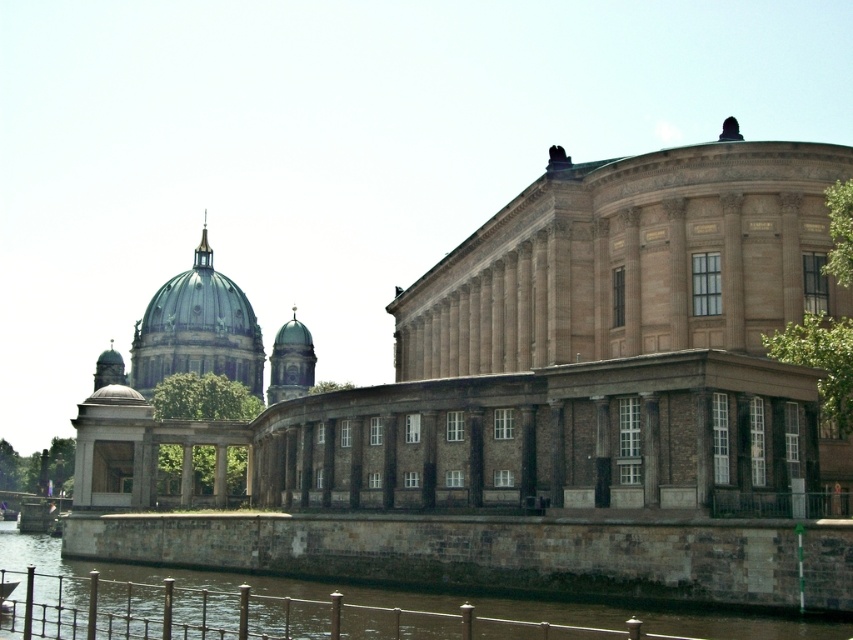
Question: Is brown stone building at center to the right of brown stone wall at lower left from the viewer's perspective?

Choices:
 (A) no
 (B) yes

Answer: (A)

Question: Which of the following is the closest to the observer?

Choices:
 (A) brown stone wall at lower left
 (B) brown stone building at center

Answer: (A)

Question: Is brown stone building at center smaller than brown stone wall at lower left?

Choices:
 (A) no
 (B) yes

Answer: (A)

Question: Can you confirm if brown stone building at center is positioned to the left of brown stone wall at lower left?

Choices:
 (A) yes
 (B) no

Answer: (A)

Question: Which object appears closest to the camera in this image?

Choices:
 (A) brown stone wall at lower left
 (B) brown stone building at center

Answer: (A)